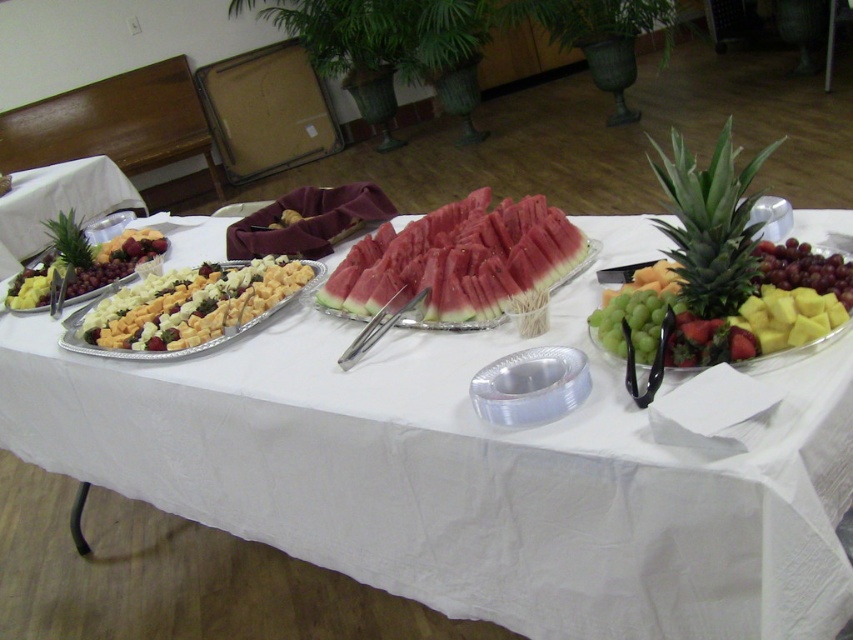
Question: Which object is the farthest from the white fabric at center?

Choices:
 (A) maroon fabric at center
 (B) yellow matte pineapple at right
 (C) pink flesh watermelon at center
 (D) matte white cheese at left

Answer: (D)

Question: Is pink flesh watermelon at center wider than white cheese at center?

Choices:
 (A) no
 (B) yes

Answer: (A)

Question: Does white cheese at center appear under yellow matte pineapple at right?

Choices:
 (A) no
 (B) yes

Answer: (B)

Question: Can you confirm if white fabric at center is positioned below pink flesh watermelon at center?

Choices:
 (A) yes
 (B) no

Answer: (A)

Question: Among these points, which one is nearest to the camera?

Choices:
 (A) (367, 368)
 (B) (257, 252)
 (C) (80, 193)

Answer: (A)

Question: Among these points, which one is nearest to the camera?

Choices:
 (A) click(138, 300)
 (B) click(363, 268)
 (C) click(318, 232)
 (D) click(213, 456)

Answer: (D)